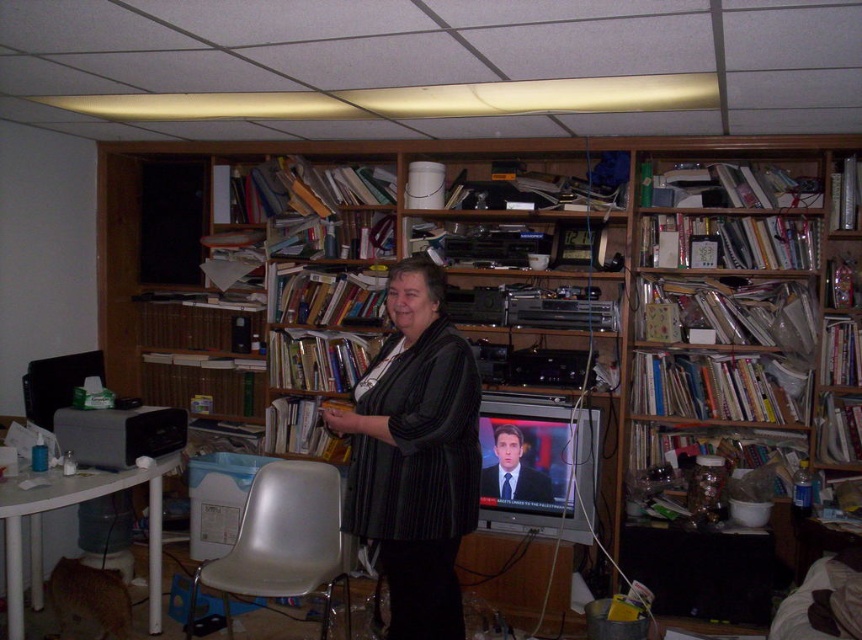
Based on the photo, you are standing in the room and want to hand the black textured sweater at center to someone who is 6 feet tall. Can they reach it without needing a stool?

The black textured sweater at center and viewer are 7.34 feet apart from each other. Since the person is 6 feet tall, they would need a stool to reach it as the distance is greater than their height.

You are standing in the room and need to sit down. There is a white plastic chair at lower center. Can you walk directly to it without moving any objects?

The white plastic chair at lower center is located at point (282, 541). Since there are no other objects mentioned in the scene description blocking the path, you can walk directly to it without moving any objects.

You are a person who wants to sit down in the room. There is a white plastic chair at lower center located at point [282,541]. Is there any object at that point that you can sit on?

Yes, there is a white plastic chair at lower center at point [282,541] that you can sit on.